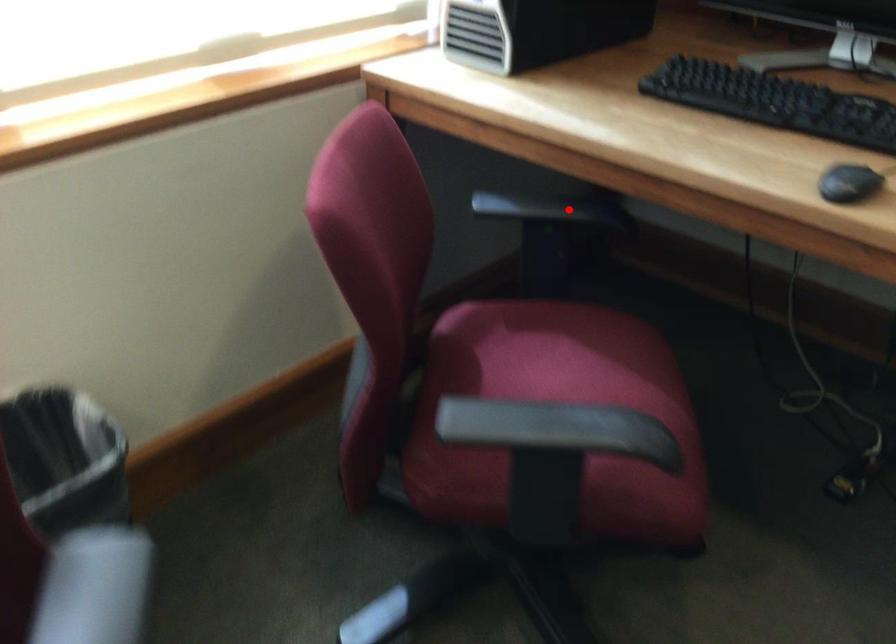
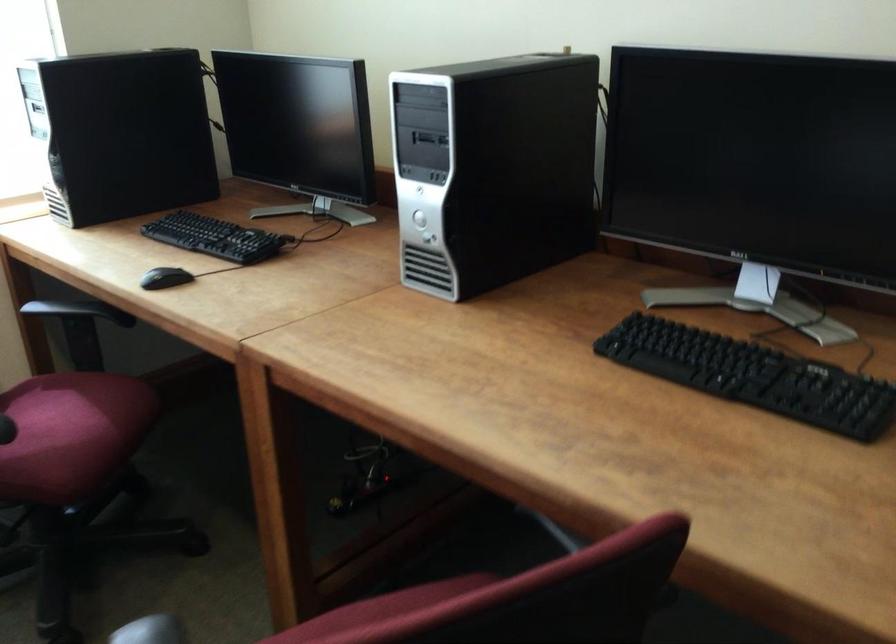
Question: I am providing you with two images of the same scene from different viewpoints. Given a red point in image1, look at the same physical point in image2. Is it:

Choices:
 (A) Closer to the viewpoint
 (B) Farther from the viewpoint

Answer: (B)